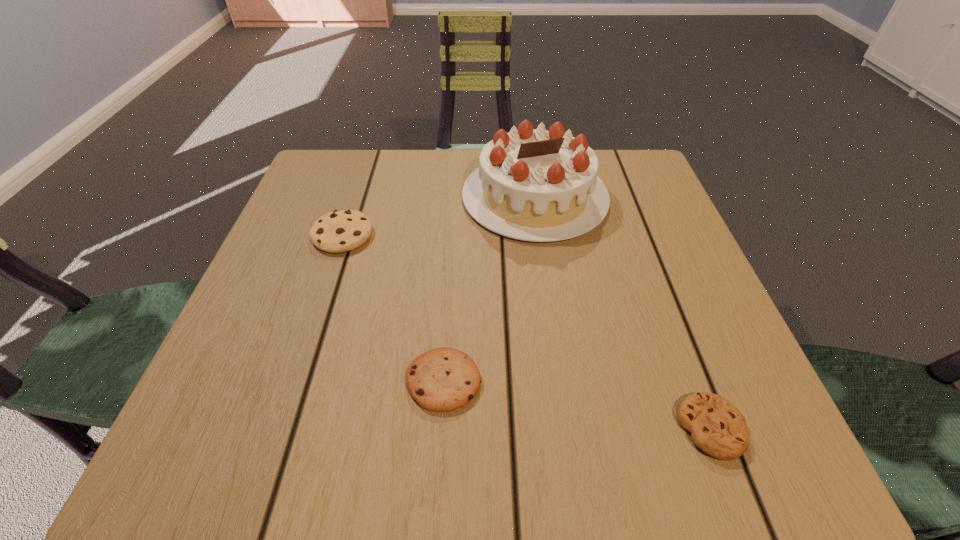
The image size is (960, 540). In order to click on free region at the right edge of the desktop in this screenshot , I will do [x=636, y=290].

You are a GUI agent. You are given a task and a screenshot of the screen. Output one action in this format:
    pyautogui.click(x=<x>, y=<y>)
    Task: Click on the free space at the far left corner
    The height and width of the screenshot is (540, 960).
    Given the screenshot: What is the action you would take?
    pyautogui.click(x=359, y=168)

Where is `vacant area at the far right corner of the desktop`? vacant area at the far right corner of the desktop is located at coordinates (640, 157).

You are a GUI agent. You are given a task and a screenshot of the screen. Output one action in this format:
    pyautogui.click(x=<x>, y=<y>)
    Task: Click on the free space that is in between the leftmost cookie and the second cookie from left to right
    
    Given the screenshot: What is the action you would take?
    pyautogui.click(x=394, y=308)

The height and width of the screenshot is (540, 960). Identify the location of vacant space in between the tallest object and the second cookie from left to right. (490, 289).

Where is `free spot between the tallest object and the rightmost cookie`? This screenshot has width=960, height=540. free spot between the tallest object and the rightmost cookie is located at coordinates [623, 313].

Find the location of a particular element. The height and width of the screenshot is (540, 960). free area in between the second tallest object and the second shortest cookie is located at coordinates (394, 308).

This screenshot has width=960, height=540. Identify the location of vacant space that is in between the birthday cake and the second tallest cookie. (490, 289).

Locate an element on the screen. vacant region between the second cookie from left to right and the birthday cake is located at coordinates (490, 289).

This screenshot has width=960, height=540. In order to click on empty location between the rightmost cookie and the farthest cookie in this screenshot , I will do `click(527, 332)`.